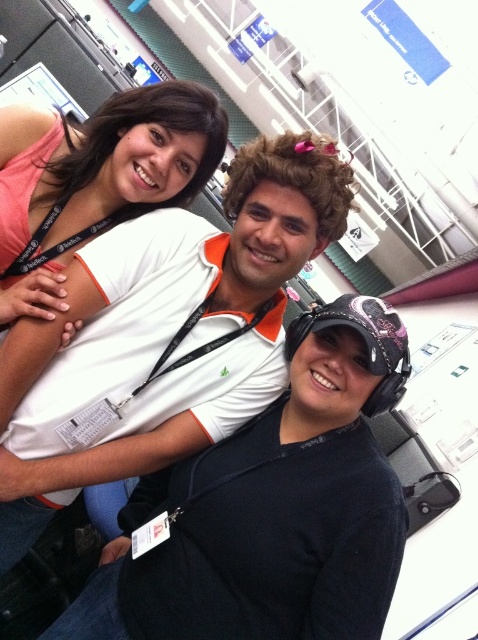
Between white matte polo shirt at center and matte pink tank top at upper left, which one has less height?

matte pink tank top at upper left

Who is more distant from viewer, [340,220] or [94,166]?

Positioned behind is point [94,166].

You are a GUI agent. You are given a task and a screenshot of the screen. Output one action in this format:
    pyautogui.click(x=<x>, y=<y>)
    Task: Click on the white matte polo shirt at center
    This screenshot has width=478, height=640.
    Given the screenshot: What is the action you would take?
    pyautogui.click(x=163, y=330)

Is point (142, 605) positioned in front of point (248, 346)?

Yes, point (142, 605) is closer to viewer.

Between point (283, 588) and point (321, 212), which one is positioned in front?

Point (283, 588) is more forward.

Describe the element at coordinates (271, 508) in the screenshot. Image resolution: width=478 pixels, height=640 pixels. I see `black matte cap at center` at that location.

Find the location of `black matte cap at center`. black matte cap at center is located at coordinates (271, 508).

Can you confirm if black matte cap at center is smaller than matte pink tank top at upper left?

No, black matte cap at center is not smaller than matte pink tank top at upper left.

Describe the element at coordinates (271, 508) in the screenshot. The width and height of the screenshot is (478, 640). I see `black matte cap at center` at that location.

Which is behind, point (357, 420) or point (202, 164)?

The point (202, 164) is behind.

Locate an element on the screen. black matte cap at center is located at coordinates (271, 508).